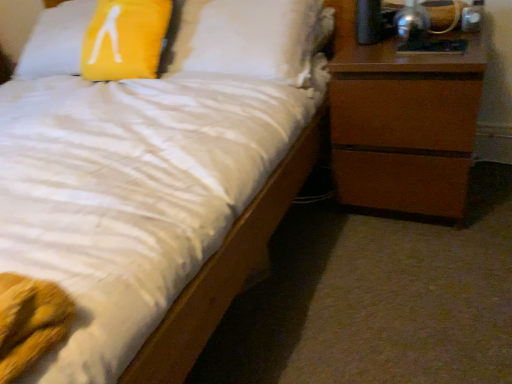
The image size is (512, 384). In order to click on yellow fabric pillow at upper left in this screenshot , I will do `click(56, 41)`.

Describe the element at coordinates (56, 41) in the screenshot. The width and height of the screenshot is (512, 384). I see `yellow fabric pillow at upper left` at that location.

This screenshot has height=384, width=512. Describe the element at coordinates (402, 122) in the screenshot. I see `brown wood chest of drawers at right` at that location.

The height and width of the screenshot is (384, 512). What are the coordinates of `yellow fabric pillow at upper left` in the screenshot? It's located at (56, 41).

Considering the positions of point (396, 79) and point (405, 40), is point (396, 79) closer or farther from the camera than point (405, 40)?

Clearly, point (396, 79) is closer to the camera than point (405, 40).

From a real-world perspective, between brown wood chest of drawers at right and metallic silver lamp at upper right, who is vertically lower?

In real-world perspective, brown wood chest of drawers at right is lower.

From the picture: Is brown wood chest of drawers at right wider or thinner than metallic silver lamp at upper right?

Considering their sizes, brown wood chest of drawers at right looks broader than metallic silver lamp at upper right.

Considering the sizes of objects yellow fabric pillow at upper left and brown wood chest of drawers at right in the image provided, who is bigger, yellow fabric pillow at upper left or brown wood chest of drawers at right?

yellow fabric pillow at upper left is bigger.

Does yellow fabric pillow at upper left come in front of brown wood chest of drawers at right?

That is False.

Is point (54, 23) closer to camera compared to point (419, 174)?

No, (54, 23) is further to viewer.

Visually, is yellow fabric pillow at upper left positioned to the left or to the right of brown wood chest of drawers at right?

yellow fabric pillow at upper left is positioned on brown wood chest of drawers at right's left side.

The height and width of the screenshot is (384, 512). I want to click on pillow beneath the metallic silver lamp at upper right (from a real-world perspective), so click(x=56, y=41).

Is yellow fabric pillow at upper left positioned beyond the bounds of metallic silver lamp at upper right?

Yes, yellow fabric pillow at upper left is outside of metallic silver lamp at upper right.

From the image's perspective, which is below, yellow fabric pillow at upper left or metallic silver lamp at upper right?

From the image's view, metallic silver lamp at upper right is below.

From a real-world perspective, is yellow fabric pillow at upper left over metallic silver lamp at upper right?

Incorrect, from a real-world perspective, yellow fabric pillow at upper left is lower than metallic silver lamp at upper right.

Which of these two, brown wood chest of drawers at right or yellow fabric pillow at upper left, is wider?

brown wood chest of drawers at right is wider.

Can you confirm if brown wood chest of drawers at right is shorter than yellow fabric pillow at upper left?

No.

What's the angular difference between brown wood chest of drawers at right and yellow fabric pillow at upper left's facing directions?

10.1 degrees.

Who is smaller, brown wood chest of drawers at right or yellow fabric pillow at upper left?

With smaller size is brown wood chest of drawers at right.

Which of these two, metallic silver lamp at upper right or yellow fabric pillow at upper left, stands taller?

yellow fabric pillow at upper left.

Is metallic silver lamp at upper right positioned with its back to yellow fabric pillow at upper left?

No.

Identify the location of bedside lamp that is in front of the yellow fabric pillow at upper left. (412, 23).

From a real-world perspective, is metallic silver lamp at upper right located beneath yellow fabric pillow at upper left?

Actually, metallic silver lamp at upper right is physically above yellow fabric pillow at upper left in the real world.

The image size is (512, 384). What are the coordinates of `the chest of drawers below the metallic silver lamp at upper right (from the image's perspective)` in the screenshot? It's located at (402, 122).

How much distance is there between metallic silver lamp at upper right and brown wood chest of drawers at right?

10.83 inches.

From a real-world perspective, is metallic silver lamp at upper right located beneath brown wood chest of drawers at right?

Actually, metallic silver lamp at upper right is physically above brown wood chest of drawers at right in the real world.

What's the angular difference between metallic silver lamp at upper right and brown wood chest of drawers at right's facing directions?

The angular difference between metallic silver lamp at upper right and brown wood chest of drawers at right is 10.7 degrees.

You are a GUI agent. You are given a task and a screenshot of the screen. Output one action in this format:
    pyautogui.click(x=<x>, y=<y>)
    Task: Click on the chest of drawers lying in front of the metallic silver lamp at upper right
    This screenshot has height=384, width=512.
    Given the screenshot: What is the action you would take?
    point(402,122)

Where is `the chest of drawers below the yellow fabric pillow at upper left (from the image's perspective)`? This screenshot has height=384, width=512. the chest of drawers below the yellow fabric pillow at upper left (from the image's perspective) is located at coordinates (402, 122).

When comparing their distances from metallic silver lamp at upper right, does yellow fabric pillow at upper left or brown wood chest of drawers at right seem further?

yellow fabric pillow at upper left is positioned further to the anchor metallic silver lamp at upper right.

Looking at the image, which one is located further to yellow fabric pillow at upper left, metallic silver lamp at upper right or brown wood chest of drawers at right?

Among the two, metallic silver lamp at upper right is located further to yellow fabric pillow at upper left.

When comparing their distances from brown wood chest of drawers at right, does yellow fabric pillow at upper left or metallic silver lamp at upper right seem closer?

metallic silver lamp at upper right lies closer to brown wood chest of drawers at right than the other object.

When comparing their distances from brown wood chest of drawers at right, does metallic silver lamp at upper right or yellow fabric pillow at upper left seem closer?

metallic silver lamp at upper right.

Which object lies further to the anchor point yellow fabric pillow at upper left, brown wood chest of drawers at right or metallic silver lamp at upper right?

metallic silver lamp at upper right.

Looking at this image, which object lies further to the anchor point metallic silver lamp at upper right, brown wood chest of drawers at right or yellow fabric pillow at upper left?

yellow fabric pillow at upper left.

Find the location of a particular element. The height and width of the screenshot is (384, 512). bedside lamp between yellow fabric pillow at upper left and brown wood chest of drawers at right from left to right is located at coordinates (412, 23).